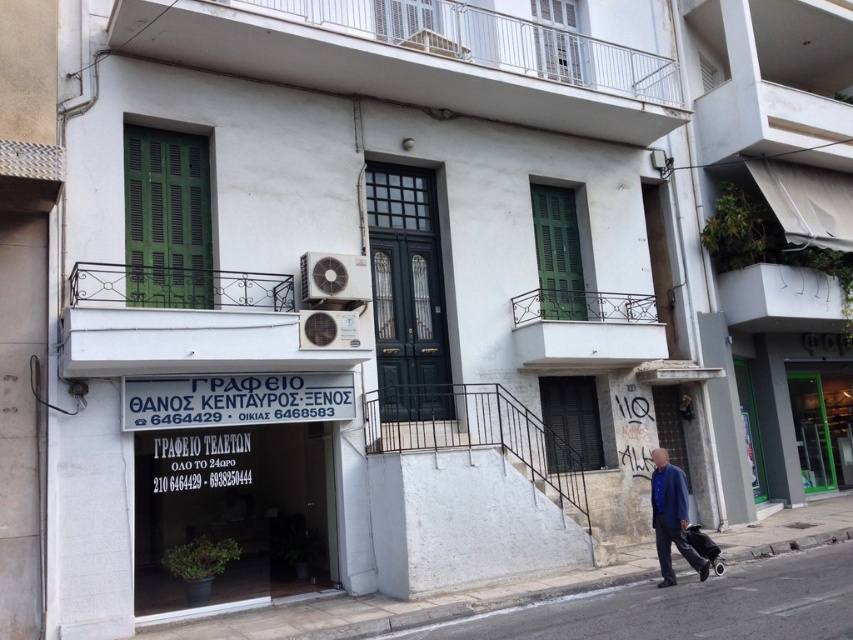
You are standing on the sidewalk and want to enter the building through the central door. The gray concrete pavement at lower center is where you are currently standing. Can you estimate how far you need to walk to reach the central door?

The gray concrete pavement at lower center is 5.75 meters away from you, so you need to walk approximately 5.75 meters to reach the central door.

You are a delivery person trying to place a large package on the gray concrete pavement at lower center. However, there is a blue denim jacket at lower right nearby. Can you place the package on the pavement without moving the jacket?

The gray concrete pavement at lower center might be wider than blue denim jacket at lower right, so there could be enough space to place the package without moving the jacket.

You are a delivery person with a package that needs to be placed exactly 1.5 meters away from the blue denim jacket at lower right. Is the gray concrete pavement at lower center a suitable location for placing the package?

The gray concrete pavement at lower center is 1.23 meters from the blue denim jacket at lower right, which is less than the required 1.5 meters. Therefore, the gray concrete pavement at lower center is not a suitable location for placing the package.